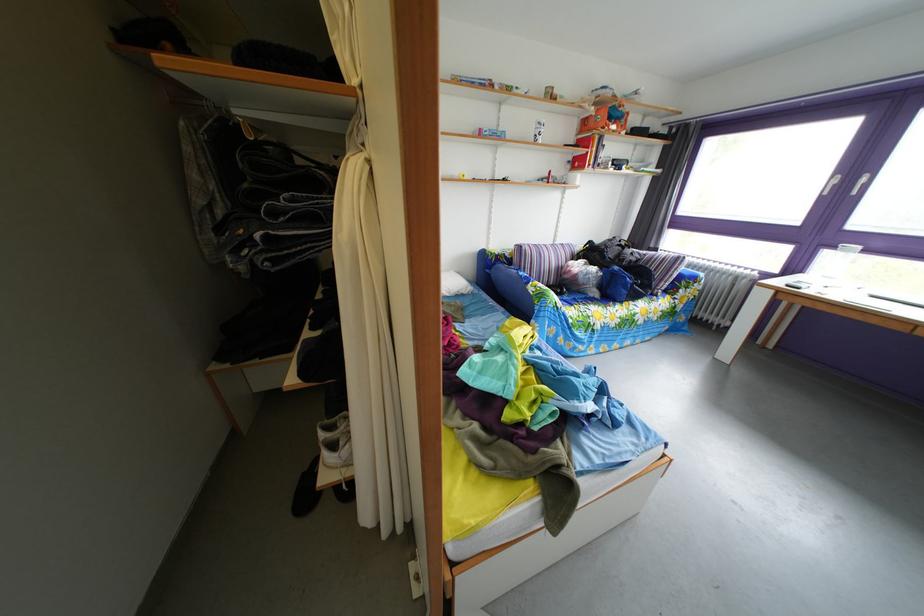
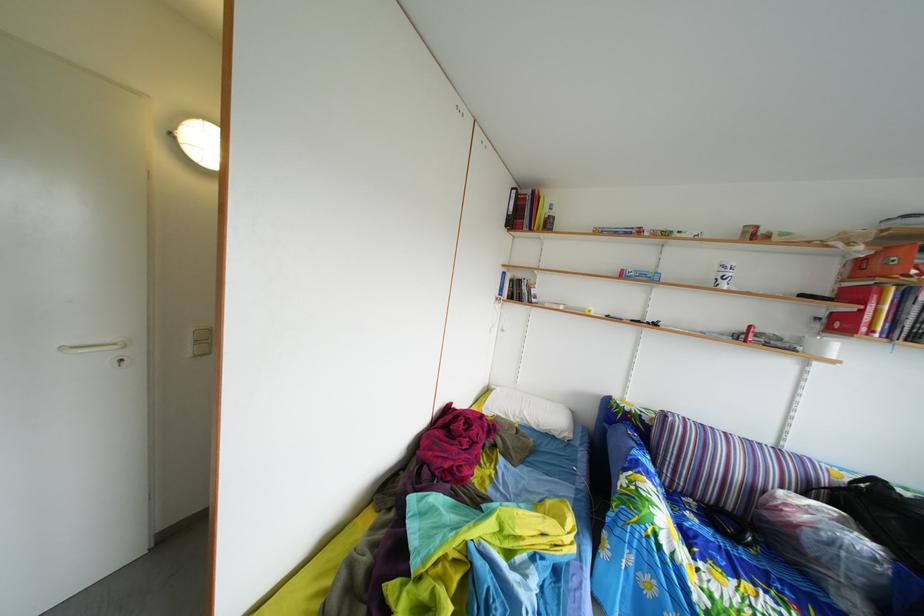
Question: The first image is from the beginning of the video and the second image is from the end. How did the camera likely rotate when shooting the video?

Choices:
 (A) Left
 (B) Right
 (C) Up
 (D) Down

Answer: (A)